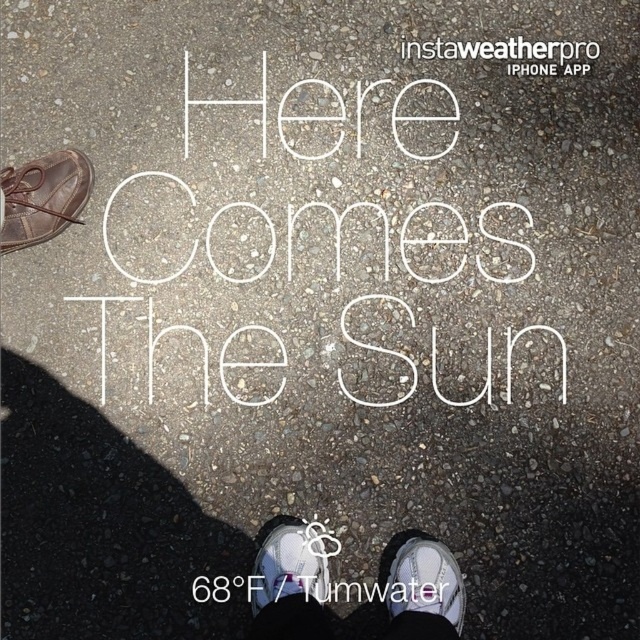
You are a delivery robot with a width of 1.2 meters. You need to move from the brown leather shoe at upper left to the white mesh shoe at lower center. Can you fit through the space between them?

The brown leather shoe at upper left and white mesh shoe at lower center are 1.30 meters apart, so the delivery robot with a width of 1.2 meters can fit through the space between them since it is narrower than the distance between the shoes.

You are standing on the pavement and see the white leather shoe at center and the white mesh shoe at lower center. Which shoe is positioned more to the left side?

The white leather shoe at center is positioned more to the left side than the white mesh shoe at lower center.